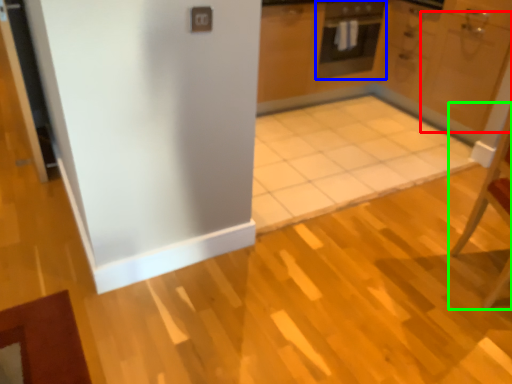
Question: Which object is the farthest from door (highlighted by a red box)? Choose among these: oven (highlighted by a blue box) or chair (highlighted by a green box).

Choices:
 (A) oven
 (B) chair

Answer: (B)